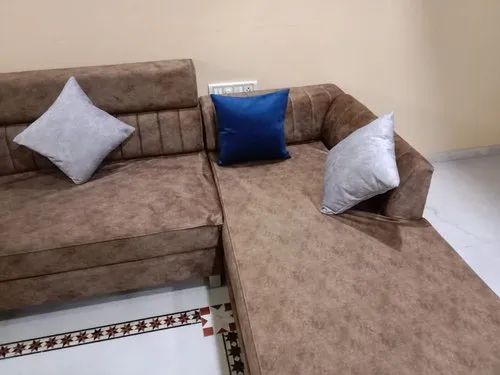
Locate an element on the screen. The width and height of the screenshot is (500, 375). floor in front of couch is located at coordinates (139, 357).